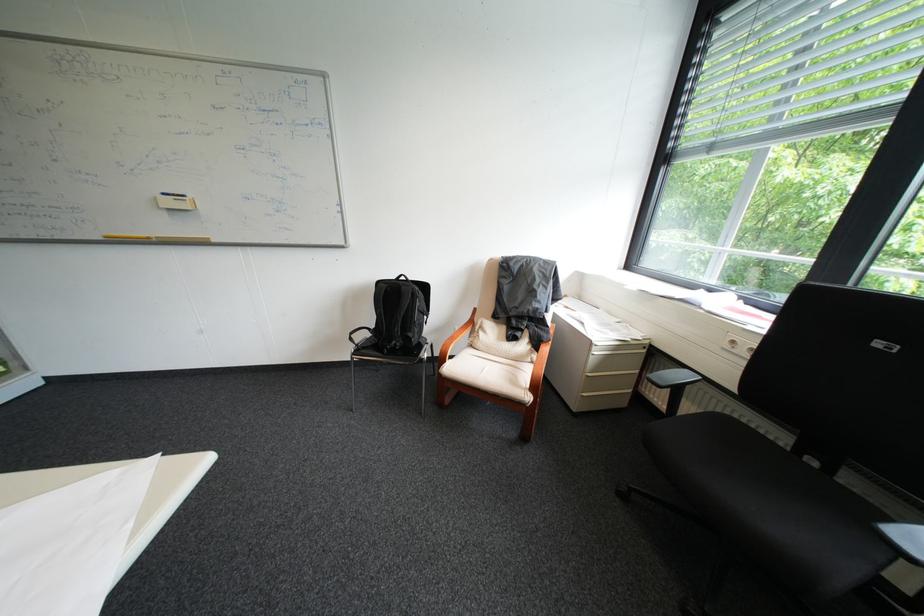
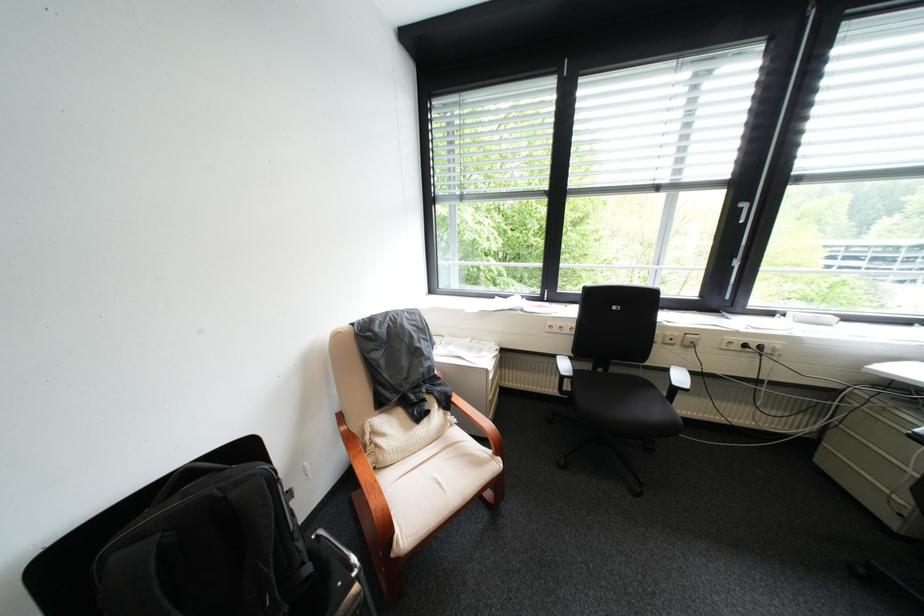
Question: The images are taken continuously from a first-person perspective. In which direction is your viewpoint rotating?

Choices:
 (A) Left
 (B) Right
 (C) Up
 (D) Down

Answer: (B)